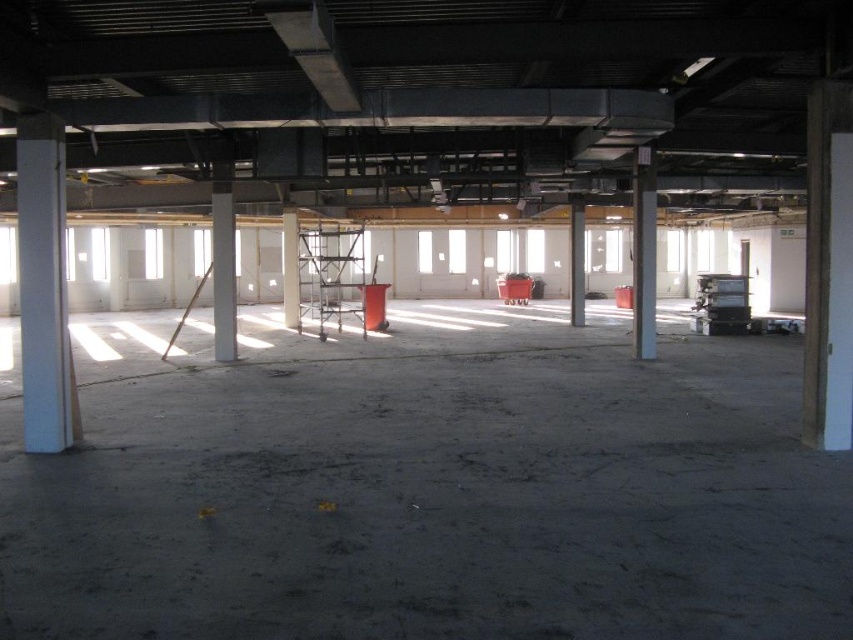
Is point (41, 240) closer to camera compared to point (572, 278)?

Yes, point (41, 240) is in front of point (572, 278).

Measure the distance between white concrete pillar at left and white concrete pillar at center.

A distance of 13.64 meters exists between white concrete pillar at left and white concrete pillar at center.

Find the location of `white concrete pillar at left`. white concrete pillar at left is located at coordinates (44, 285).

Locate an element on the screen. white concrete pillar at left is located at coordinates (44, 285).

Is white concrete pillar at left shorter than white smooth pillar at center?

No, white concrete pillar at left is not shorter than white smooth pillar at center.

Who is positioned more to the right, white concrete pillar at left or white smooth pillar at center?

Positioned to the right is white concrete pillar at left.

Who is more distant from viewer, [28,186] or [294,285]?

The point [294,285] is behind.

The image size is (853, 640). I want to click on white concrete pillar at left, so click(44, 285).

Identify the location of white smooth pillar at center. (289, 268).

Is point (297, 276) in front of point (570, 310)?

Yes, it is in front of point (570, 310).

Identify the location of white smooth pillar at center. The width and height of the screenshot is (853, 640). pos(289,268).